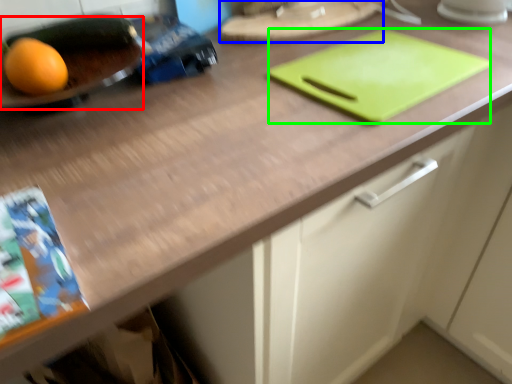
Question: Estimate the real-world distances between objects in this image. Which object is closer to tray (highlighted by a red box), tray (highlighted by a blue box) or tray (highlighted by a green box)?

Choices:
 (A) tray
 (B) tray

Answer: (A)